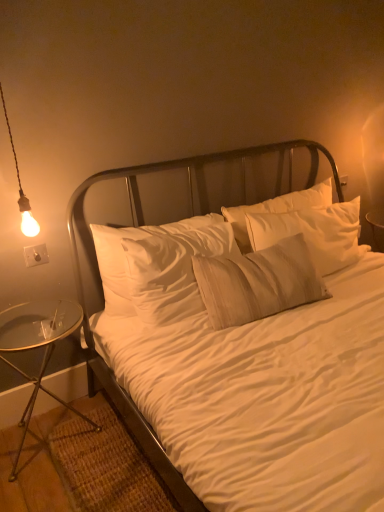
Describe the element at coordinates (189, 194) in the screenshot. Image resolution: width=384 pixels, height=512 pixels. I see `metallic silver headboard at center` at that location.

Image resolution: width=384 pixels, height=512 pixels. What do you see at coordinates (243, 362) in the screenshot? I see `white cotton bed at center` at bounding box center [243, 362].

Describe the element at coordinates (38, 345) in the screenshot. I see `transparent glass table at lower left` at that location.

Locate an element on the screen. metallic silver headboard at center is located at coordinates (189, 194).

Based on the photo, would you say white cotton bed at center is inside or outside transparent glass table at lower left?

white cotton bed at center lies outside transparent glass table at lower left.

Is the position of white cotton bed at center more distant than that of transparent glass table at lower left?

No, white cotton bed at center is in front of transparent glass table at lower left.

This screenshot has height=512, width=384. I want to click on nightstand to the left of white cotton bed at center, so click(x=38, y=345).

Is white cotton bed at center oriented away from transparent glass table at lower left?

No.

Is transparent glass table at lower left oriented away from matte bulb at left?

No, matte bulb at left is not at the back of transparent glass table at lower left.

From the picture: From a real-world perspective, which is physically above, transparent glass table at lower left or matte bulb at left?

From a 3D spatial view, matte bulb at left is above.

Considering the relative sizes of transparent glass table at lower left and matte bulb at left in the image provided, is transparent glass table at lower left taller than matte bulb at left?

No, transparent glass table at lower left is not taller than matte bulb at left.

Does transparent glass table at lower left have a smaller size compared to matte bulb at left?

Actually, transparent glass table at lower left might be larger than matte bulb at left.

Does metallic silver headboard at center contain matte bulb at left?

No, matte bulb at left is not inside metallic silver headboard at center.

From the image's perspective, is metallic silver headboard at center beneath matte bulb at left?

Correct, metallic silver headboard at center appears lower than matte bulb at left in the image.

Where is `headboard behind the matte bulb at left`? The height and width of the screenshot is (512, 384). headboard behind the matte bulb at left is located at coordinates (189, 194).

Relative to matte bulb at left, is metallic silver headboard at center in front or behind?

Visually, metallic silver headboard at center is located behind matte bulb at left.

From the picture: Which object is closer to the camera taking this photo, matte bulb at left or metallic silver headboard at center?

Positioned in front is matte bulb at left.

In terms of height, does matte bulb at left look taller or shorter compared to metallic silver headboard at center?

Clearly, matte bulb at left is taller compared to metallic silver headboard at center.

How many degrees apart are the facing directions of matte bulb at left and metallic silver headboard at center?

The facing directions of matte bulb at left and metallic silver headboard at center are 3.32 degrees apart.

In the scene shown: Can you confirm if matte bulb at left is positioned to the right of metallic silver headboard at center?

Incorrect, matte bulb at left is not on the right side of metallic silver headboard at center.

Which is behind, point (2, 99) or point (47, 319)?

The point (47, 319) is behind.

The image size is (384, 512). Find the location of `nightstand located behind the matte bulb at left`. nightstand located behind the matte bulb at left is located at coordinates (38, 345).

Can you see matte bulb at left touching transparent glass table at lower left?

matte bulb at left is not next to transparent glass table at lower left, and they're not touching.

Between matte bulb at left and transparent glass table at lower left, which one has smaller width?

matte bulb at left.

Is white cotton bed at center in front of or behind metallic silver headboard at center in the image?

Clearly, white cotton bed at center is in front of metallic silver headboard at center.

From the image's perspective, is white cotton bed at center above or below metallic silver headboard at center?

Based on their image positions, white cotton bed at center is located beneath metallic silver headboard at center.

Is metallic silver headboard at center surrounded by white cotton bed at center?

Yes, metallic silver headboard at center is inside white cotton bed at center.

The width and height of the screenshot is (384, 512). In order to click on bed in front of the metallic silver headboard at center in this screenshot , I will do `click(243, 362)`.

From the image's perspective, would you say metallic silver headboard at center is positioned over transparent glass table at lower left?

Yes, from the image's perspective, metallic silver headboard at center is on top of transparent glass table at lower left.

Looking at this image, what's the angular difference between metallic silver headboard at center and transparent glass table at lower left's facing directions?

The angle between the facing direction of metallic silver headboard at center and the facing direction of transparent glass table at lower left is 2.91 degrees.

Are metallic silver headboard at center and transparent glass table at lower left far apart?

No, metallic silver headboard at center is not far away from transparent glass table at lower left.

Where is `bed that appears on the right of transparent glass table at lower left`? bed that appears on the right of transparent glass table at lower left is located at coordinates (243, 362).

At what (x,y) coordinates should I click in order to perform the action: click on nightstand on the left of matte bulb at left. Please return your answer as a coordinate pair (x, y). This screenshot has height=512, width=384. Looking at the image, I should click on (38, 345).

In the scene shown: Based on their spatial positions, is metallic silver headboard at center or white cotton bed at center further from transparent glass table at lower left?

white cotton bed at center is positioned further to the anchor transparent glass table at lower left.

Considering their positions, is matte bulb at left positioned closer to metallic silver headboard at center than white cotton bed at center?

white cotton bed at center is closer to metallic silver headboard at center.

When comparing their distances from transparent glass table at lower left, does metallic silver headboard at center or matte bulb at left seem further?

The object further to transparent glass table at lower left is matte bulb at left.

From the picture: When comparing their distances from matte bulb at left, does transparent glass table at lower left or white cotton bed at center seem closer?

transparent glass table at lower left lies closer to matte bulb at left than the other object.

From the image, which object appears to be nearer to metallic silver headboard at center, transparent glass table at lower left or matte bulb at left?

transparent glass table at lower left lies closer to metallic silver headboard at center than the other object.

Considering their positions, is white cotton bed at center positioned closer to transparent glass table at lower left than matte bulb at left?

matte bulb at left is positioned closer to the anchor transparent glass table at lower left.

Based on the photo, considering their positions, is transparent glass table at lower left positioned further to matte bulb at left than metallic silver headboard at center?

metallic silver headboard at center is further to matte bulb at left.

From the image, which object appears to be nearer to white cotton bed at center, metallic silver headboard at center or transparent glass table at lower left?

The object closer to white cotton bed at center is metallic silver headboard at center.

The height and width of the screenshot is (512, 384). Identify the location of lamp situated between transparent glass table at lower left and white cotton bed at center from left to right. (21, 189).

I want to click on headboard that lies between matte bulb at left and transparent glass table at lower left from top to bottom, so click(x=189, y=194).

I want to click on headboard between transparent glass table at lower left and white cotton bed at center in the horizontal direction, so click(x=189, y=194).

At what (x,y) coordinates should I click in order to perform the action: click on headboard situated between matte bulb at left and white cotton bed at center from left to right. Please return your answer as a coordinate pair (x, y). This screenshot has height=512, width=384. Looking at the image, I should click on (189, 194).